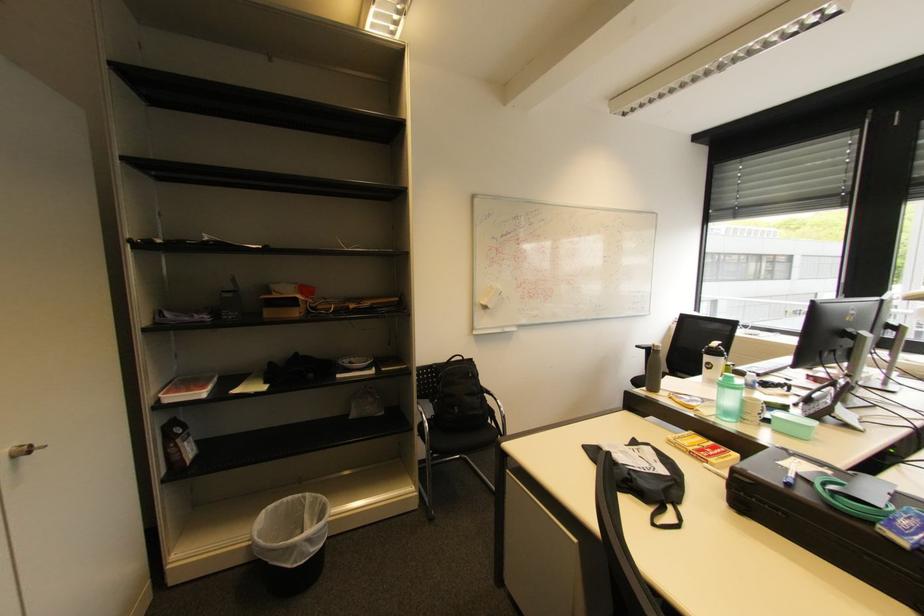
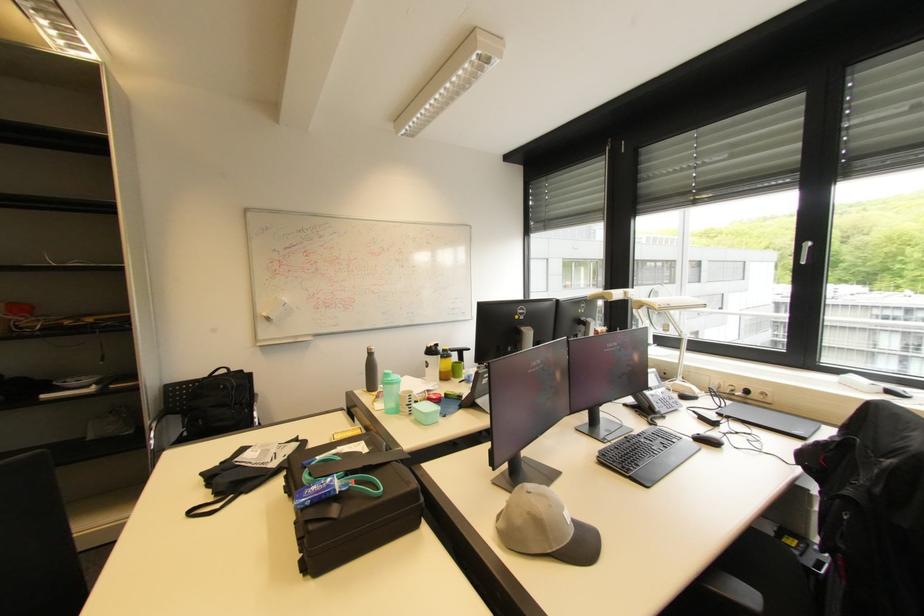
Question: Which direction would the cameraman need to move to produce the second image? Reply with the corresponding letter.

Choices:
 (A) Left
 (B) Right
 (C) Forward
 (D) Backward

Answer: (B)